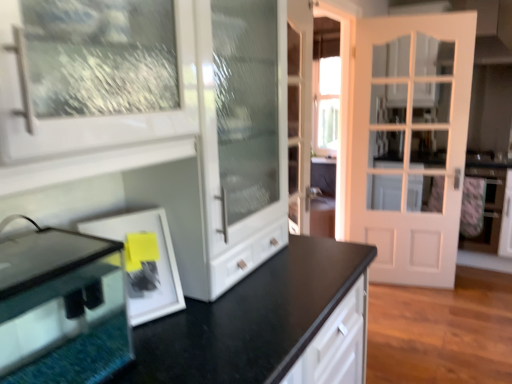
Question: Is white matte picture frame at lower left wider than clear glass fish tank at lower left?

Choices:
 (A) yes
 (B) no

Answer: (B)

Question: Is the position of white matte picture frame at lower left more distant than that of clear glass fish tank at lower left?

Choices:
 (A) yes
 (B) no

Answer: (A)

Question: From a real-world perspective, does white matte picture frame at lower left sit lower than clear glass fish tank at lower left?

Choices:
 (A) no
 (B) yes

Answer: (B)

Question: Does white matte picture frame at lower left have a lesser width compared to clear glass fish tank at lower left?

Choices:
 (A) yes
 (B) no

Answer: (A)

Question: Is white matte picture frame at lower left shorter than clear glass fish tank at lower left?

Choices:
 (A) no
 (B) yes

Answer: (B)

Question: Considering the positions of white matte picture frame at lower left and clear glass fish tank at lower left in the image, is white matte picture frame at lower left taller or shorter than clear glass fish tank at lower left?

Choices:
 (A) short
 (B) tall

Answer: (A)

Question: From the image's perspective, is white matte picture frame at lower left above or below clear glass fish tank at lower left?

Choices:
 (A) above
 (B) below

Answer: (A)

Question: From a real-world perspective, is white matte picture frame at lower left above or below clear glass fish tank at lower left?

Choices:
 (A) above
 (B) below

Answer: (B)

Question: Considering their positions, is white matte picture frame at lower left located in front of or behind clear glass fish tank at lower left?

Choices:
 (A) front
 (B) behind

Answer: (B)

Question: Is clear glass fish tank at lower left wider or thinner than white matte door at right?

Choices:
 (A) wide
 (B) thin

Answer: (A)

Question: From the image's perspective, is clear glass fish tank at lower left located above or below white matte door at right?

Choices:
 (A) above
 (B) below

Answer: (B)

Question: In terms of height, does clear glass fish tank at lower left look taller or shorter compared to white matte door at right?

Choices:
 (A) tall
 (B) short

Answer: (B)

Question: Considering their positions, is clear glass fish tank at lower left located in front of or behind white matte door at right?

Choices:
 (A) behind
 (B) front

Answer: (B)

Question: Considering the positions of clear glass fish tank at lower left and white matte picture frame at lower left in the image, is clear glass fish tank at lower left wider or thinner than white matte picture frame at lower left?

Choices:
 (A) wide
 (B) thin

Answer: (A)

Question: Does point (27, 375) appear closer or farther from the camera than point (142, 238)?

Choices:
 (A) farther
 (B) closer

Answer: (B)